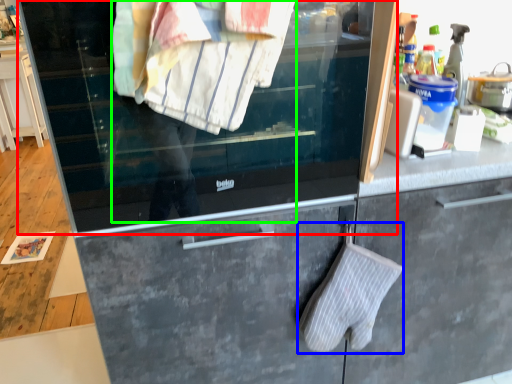
Question: Estimate the real-world distances between objects in this image. Which object is farther from window (highlighted by a red box), bath towel (highlighted by a blue box) or person (highlighted by a green box)?

Choices:
 (A) bath towel
 (B) person

Answer: (A)